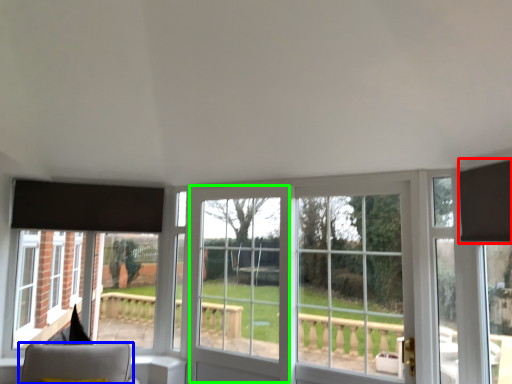
Question: Which object is the closest to the curtain (highlighted by a red box)? Choose among these: furniture (highlighted by a blue box) or screen door (highlighted by a green box).

Choices:
 (A) furniture
 (B) screen door

Answer: (B)